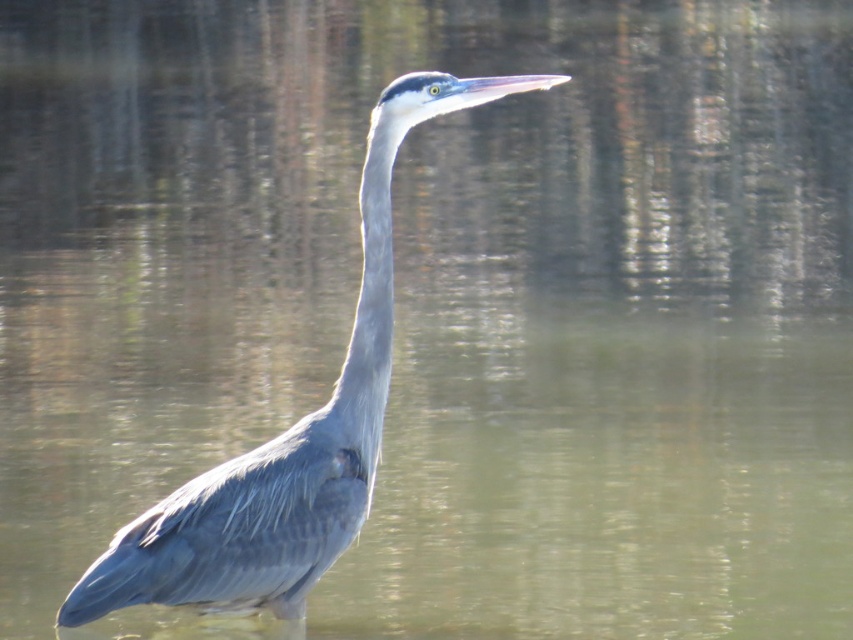
Question: Which object appears farthest from the camera in this image?

Choices:
 (A) gray matte bird at center
 (B) gray matte neck at center

Answer: (B)

Question: Can you confirm if gray matte bird at center is smaller than gray matte neck at center?

Choices:
 (A) yes
 (B) no

Answer: (B)

Question: Considering the relative positions of gray matte bird at center and gray matte neck at center in the image provided, where is gray matte bird at center located with respect to gray matte neck at center?

Choices:
 (A) right
 (B) left

Answer: (B)

Question: Which object is farther from the camera taking this photo?

Choices:
 (A) gray matte neck at center
 (B) gray matte bird at center

Answer: (A)

Question: Among these points, which one is farthest from the camera?

Choices:
 (A) (361, 200)
 (B) (155, 589)

Answer: (A)

Question: Does gray matte bird at center appear on the left side of gray matte neck at center?

Choices:
 (A) yes
 (B) no

Answer: (A)